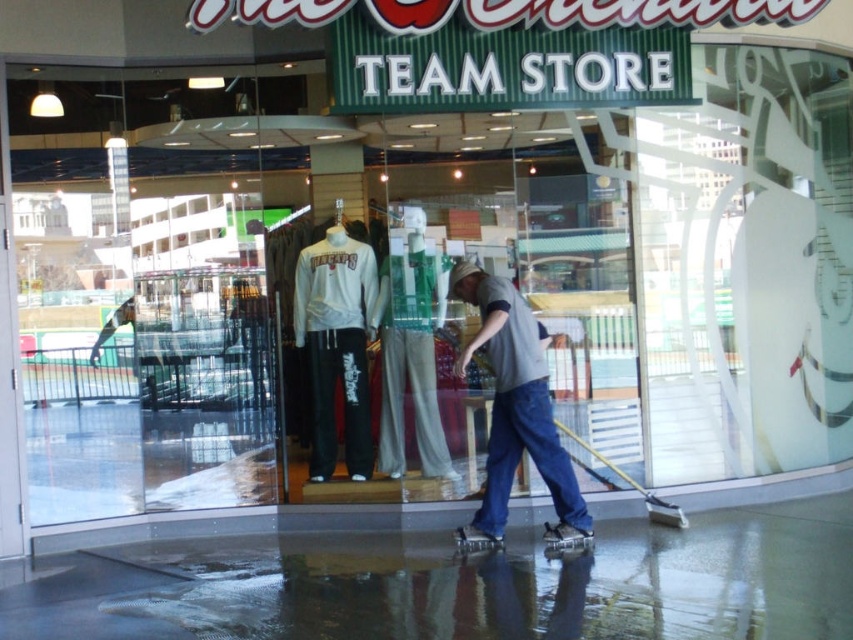
Question: Does gray cotton shirt at center have a greater width compared to white matte sweatshirt at center?

Choices:
 (A) yes
 (B) no

Answer: (A)

Question: Among these objects, which one is farthest from the camera?

Choices:
 (A) gray cotton shirt at center
 (B) transparent glass door at left
 (C) light gray fabric pants at center
 (D) white matte sweatshirt at center

Answer: (D)

Question: Does transparent glass door at left appear under transparent glass door at center?

Choices:
 (A) yes
 (B) no

Answer: (B)

Question: Which object is the closest to the light gray fabric pants at center?

Choices:
 (A) white matte sweatshirt at center
 (B) transparent glass door at center
 (C) gray cotton shirt at center

Answer: (A)

Question: Is transparent glass door at left to the left of gray cotton shirt at center from the viewer's perspective?

Choices:
 (A) no
 (B) yes

Answer: (B)

Question: Which point appears closest to the camera in this image?

Choices:
 (A) (521, 300)
 (B) (396, 317)
 (C) (195, 378)

Answer: (A)